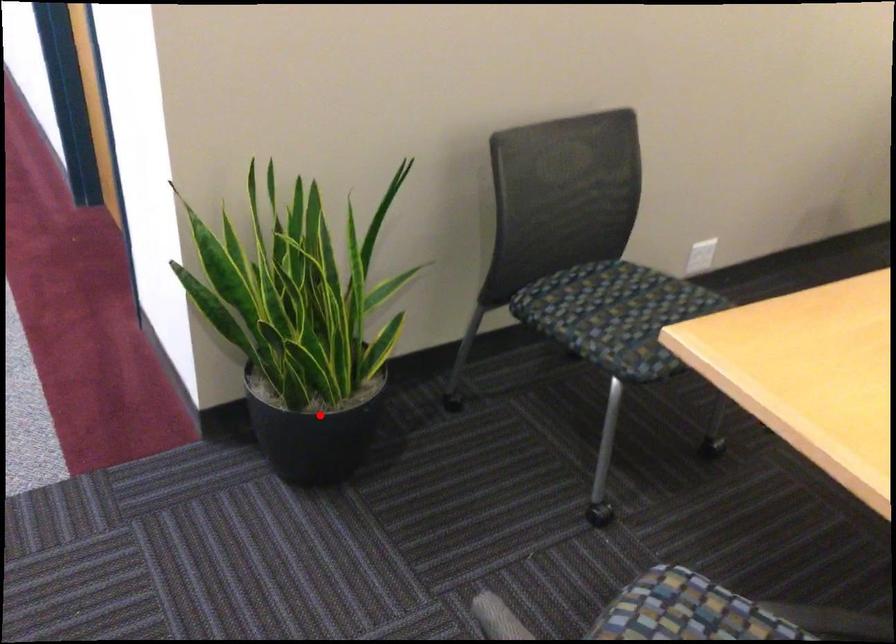
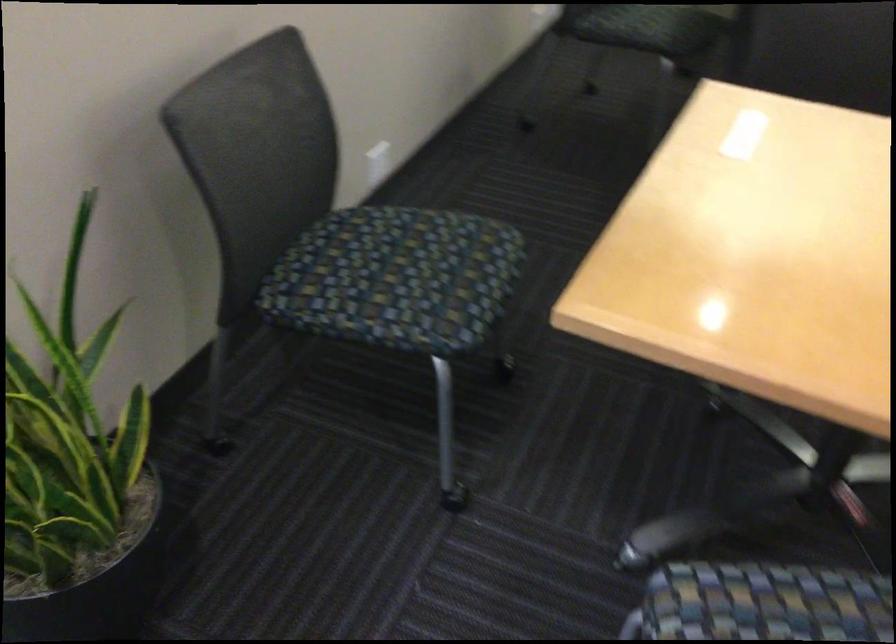
Locate, in the second image, the point that corresponds to the highlighted location in the first image.

(95, 582)